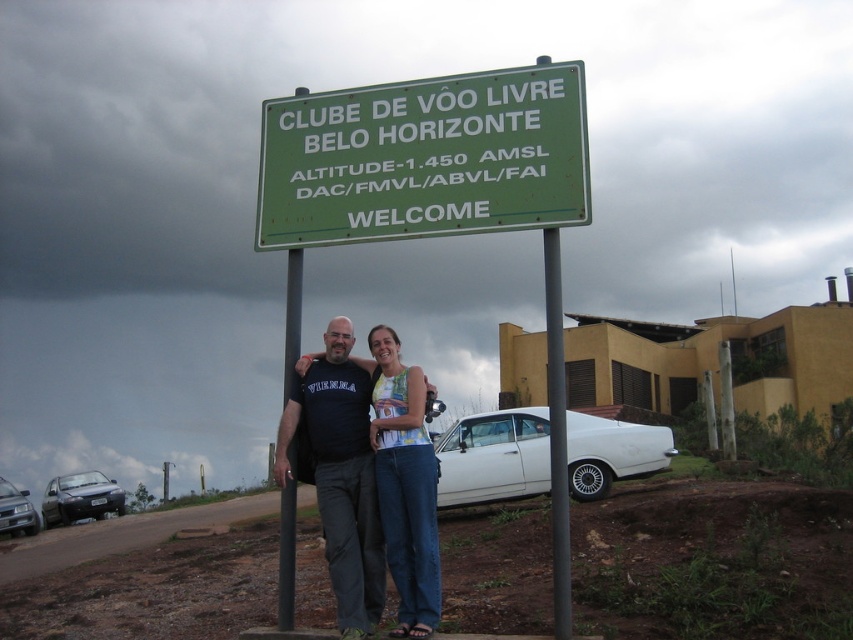
Question: Which point is closer to the camera?

Choices:
 (A) (407, 416)
 (B) (589, 420)
 (C) (339, 513)

Answer: (C)

Question: Which point is closer to the camera?

Choices:
 (A) black metal pole at center
 (B) gray metallic pole at center
 (C) white glossy car at lower right
 (D) denim pants at center

Answer: (B)

Question: Which object appears farthest from the camera in this image?

Choices:
 (A) white glossy car at lower right
 (B) black metal pole at center

Answer: (B)

Question: Can you confirm if black cotton shirt at center is smaller than denim pants at center?

Choices:
 (A) no
 (B) yes

Answer: (A)

Question: Observing the image, what is the correct spatial positioning of white glossy car at lower right in reference to denim pants at center?

Choices:
 (A) above
 (B) below

Answer: (B)

Question: Is gray metallic pole at center bigger than black metal pole at center?

Choices:
 (A) no
 (B) yes

Answer: (A)